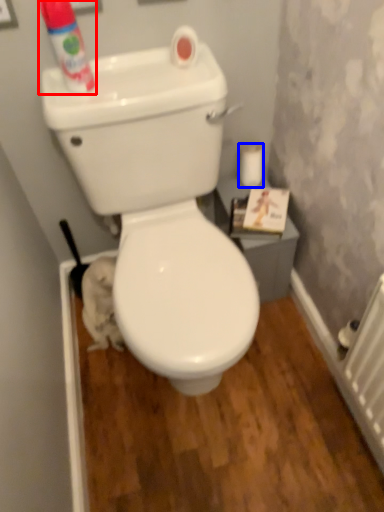
Question: Which of the following is the farthest to the observer, cleaning product (highlighted by a red box) or toilet paper (highlighted by a blue box)?

Choices:
 (A) cleaning product
 (B) toilet paper

Answer: (B)